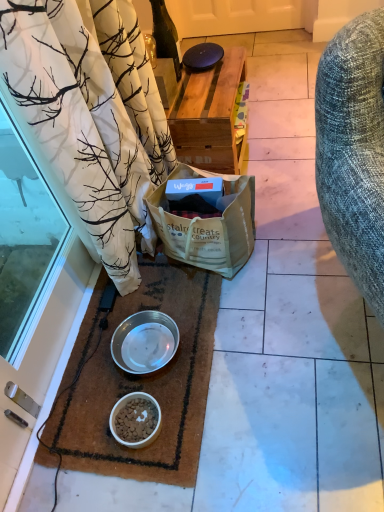
The height and width of the screenshot is (512, 384). Find the location of `free point to the right of white cardboard box at center`. free point to the right of white cardboard box at center is located at coordinates (281, 227).